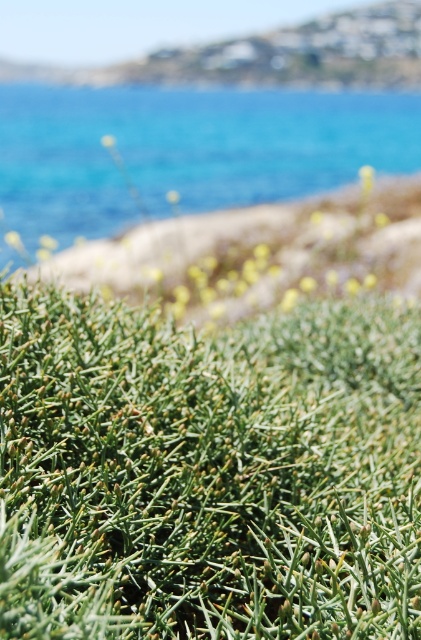
Question: Which point is farther from the camera taking this photo?

Choices:
 (A) (173, 173)
 (B) (410, 294)

Answer: (A)

Question: Is the position of blue water at upper center more distant than that of green spiky plant at lower center?

Choices:
 (A) yes
 (B) no

Answer: (A)

Question: Does blue water at upper center have a greater width compared to green spiky plant at lower center?

Choices:
 (A) yes
 (B) no

Answer: (A)

Question: Which point is farther to the camera?

Choices:
 (A) blue water at upper center
 (B) green spiky plant at lower center

Answer: (A)

Question: Can you confirm if blue water at upper center is wider than green spiky plant at lower center?

Choices:
 (A) yes
 (B) no

Answer: (A)

Question: Which object is farther from the camera taking this photo?

Choices:
 (A) blue water at upper center
 (B) green spiky plant at lower center

Answer: (A)